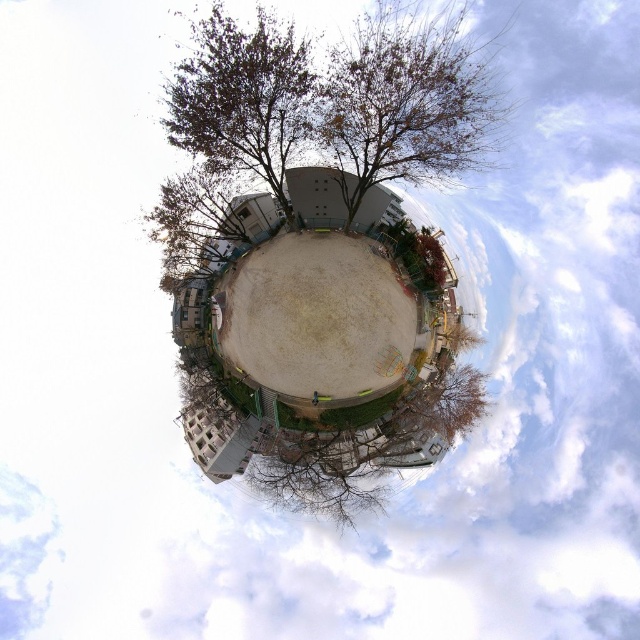
You are standing in the center of the circular park and looking around. There is a point marked at coordinates (243, 97). What object does this point correspond to?

The point at coordinates (243, 97) corresponds to the brown leafy tree at upper center.

You are a bird looking for a place to perch. You see a brown leafy tree at upper center and bare branches at center. Which tree has branches that are thinner and might be easier to land on?

The brown leafy tree at upper center has thinner branches than the bare branches at center, so it might be easier to land on.